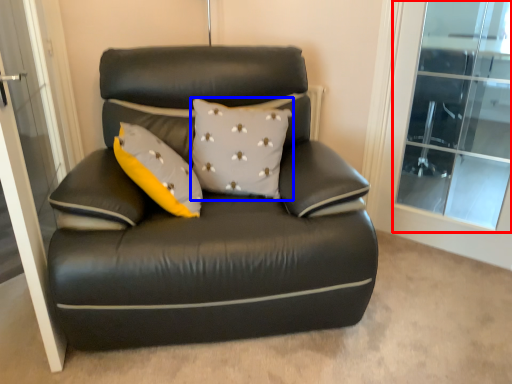
Question: Which object is closer to the camera taking this photo, window (highlighted by a red box) or pillow (highlighted by a blue box)?

Choices:
 (A) window
 (B) pillow

Answer: (B)